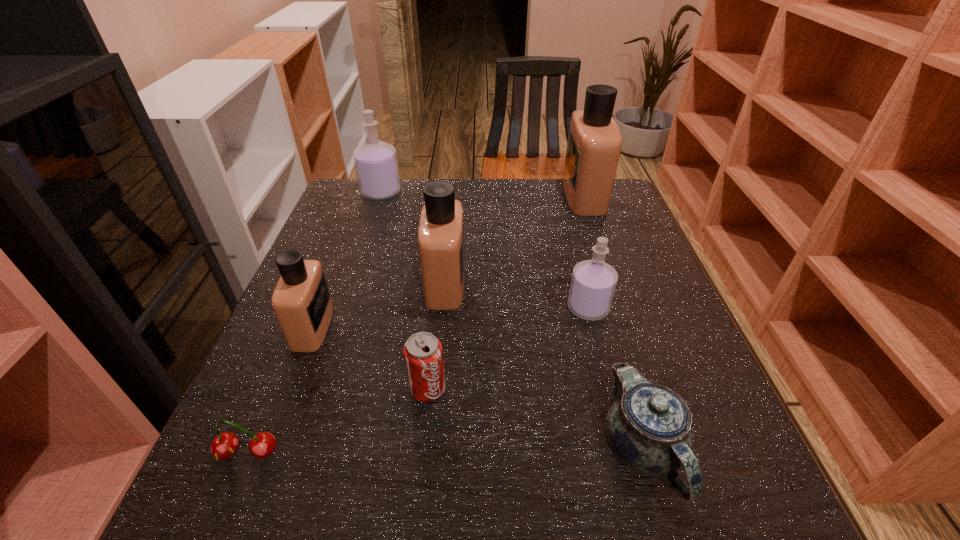
Identify the location of the rightmost beige perfume. The image size is (960, 540). point(594,144).

Locate an element on the screen. The height and width of the screenshot is (540, 960). the tallest object is located at coordinates (594, 144).

Locate an element on the screen. the bigger purple perfume is located at coordinates (376, 165).

Identify the location of the left purple perfume. Image resolution: width=960 pixels, height=540 pixels. (376, 165).

Locate an element on the screen. The height and width of the screenshot is (540, 960). the third perfume from right to left is located at coordinates (441, 226).

Identify the location of the second smallest beige perfume. (441, 226).

This screenshot has width=960, height=540. What are the coordinates of `the leftmost beige perfume` in the screenshot? It's located at point(301,300).

The height and width of the screenshot is (540, 960). I want to click on the nearer purple perfume, so click(x=593, y=283).

Where is `the smaller purple perfume`? the smaller purple perfume is located at coordinates tap(593, 283).

This screenshot has width=960, height=540. Find the location of `soda can`. soda can is located at coordinates (423, 355).